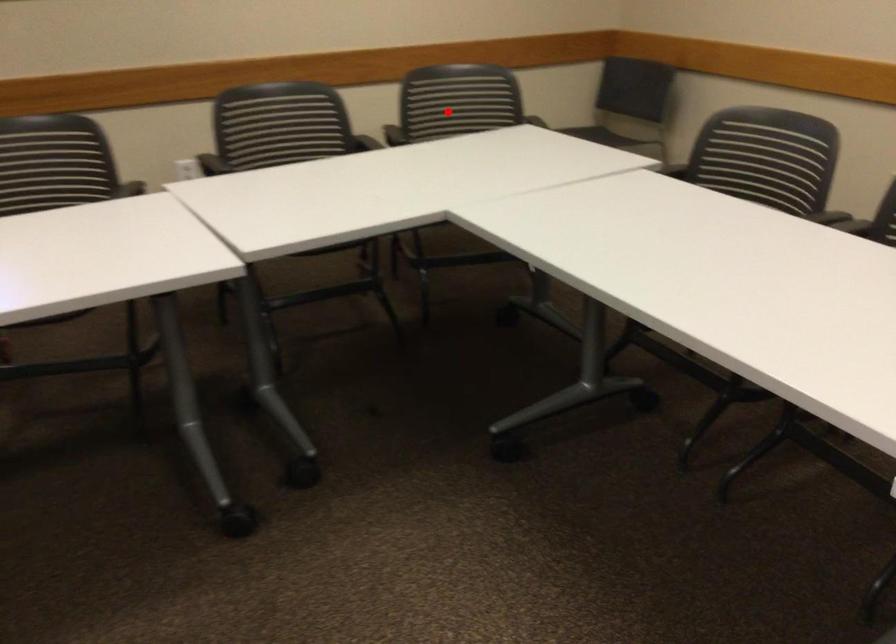
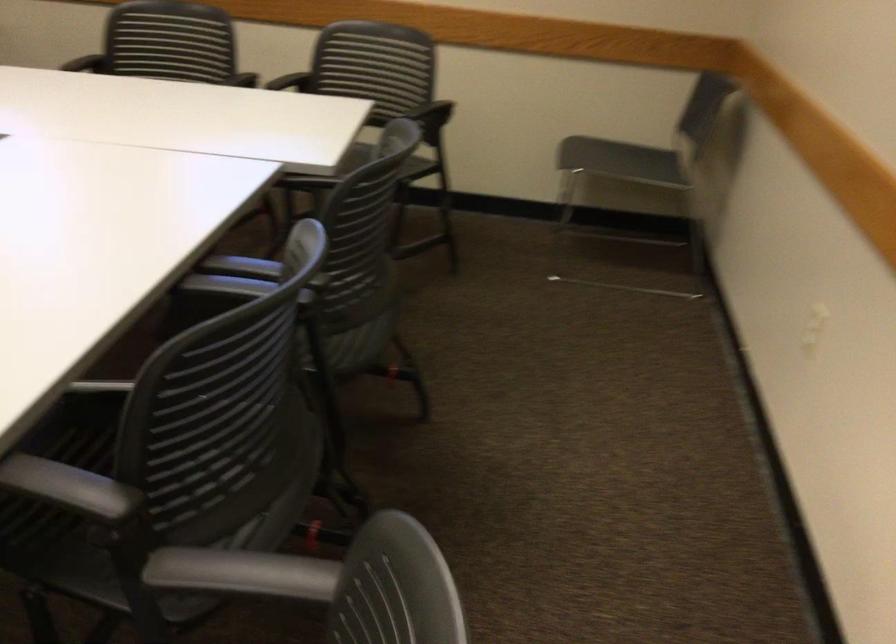
The point at the highlighted location is marked in the first image. Where is the corresponding point in the second image?

(375, 73)